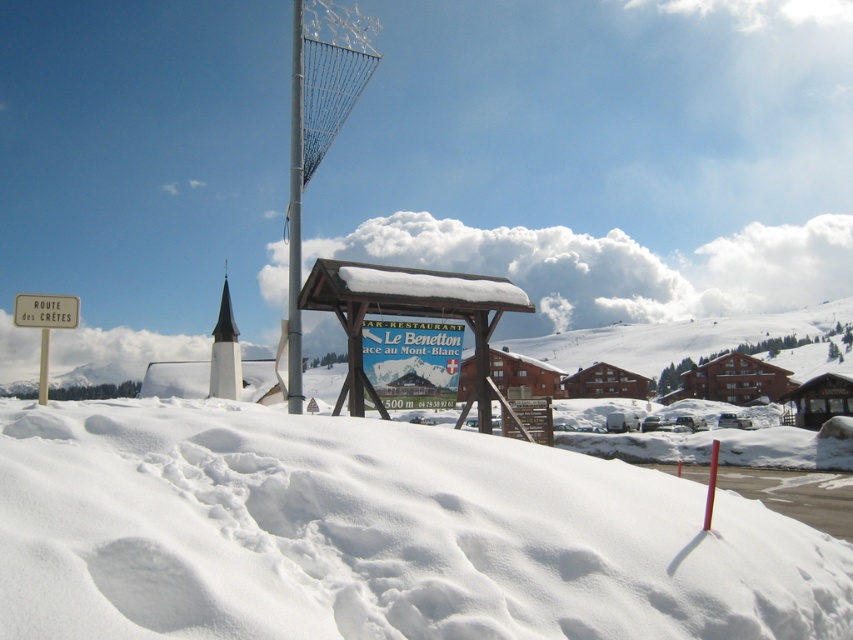
Is point (44, 300) closer to camera compared to point (68, 305)?

Yes, point (44, 300) is in front of point (68, 305).

This screenshot has height=640, width=853. In order to click on white wooden sign at left in this screenshot , I will do `click(45, 324)`.

Image resolution: width=853 pixels, height=640 pixels. What do you see at coordinates (294, 216) in the screenshot?
I see `metallic wire at center` at bounding box center [294, 216].

Between point (291, 100) and point (32, 307), which one is positioned behind?

The point (291, 100) is more distant.

This screenshot has height=640, width=853. Find the location of `metallic wire at center`. metallic wire at center is located at coordinates (294, 216).

This screenshot has width=853, height=640. What are the coordinates of `metallic wire at center` in the screenshot? It's located at (294, 216).

Between white powdery snow at lower center and wooden signboard at center, which one is positioned lower?

white powdery snow at lower center is below.

What do you see at coordinates (376, 534) in the screenshot?
I see `white powdery snow at lower center` at bounding box center [376, 534].

Where is `white powdery snow at lower center`? Image resolution: width=853 pixels, height=640 pixels. white powdery snow at lower center is located at coordinates (376, 534).